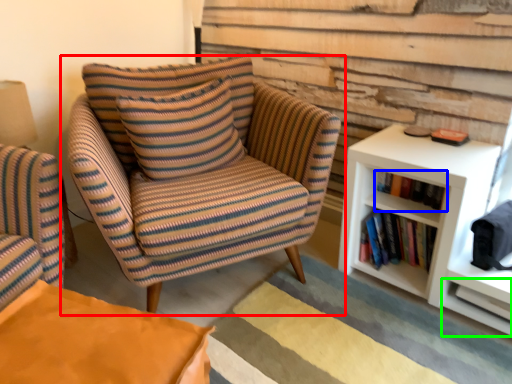
Question: Which is farther away from chair (highlighted by a red box)? book (highlighted by a blue box) or shelf (highlighted by a green box)?

Choices:
 (A) book
 (B) shelf

Answer: (B)